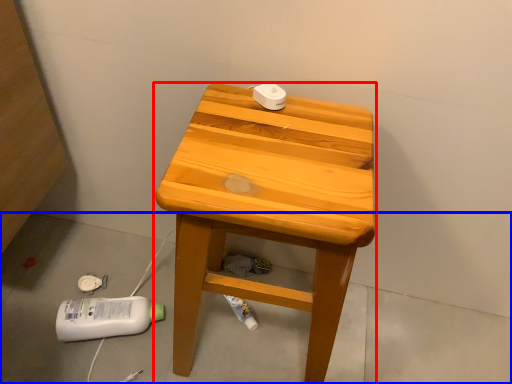
Question: Which object is further to the camera taking this photo, stool (highlighted by a red box) or concrete (highlighted by a blue box)?

Choices:
 (A) stool
 (B) concrete

Answer: (B)